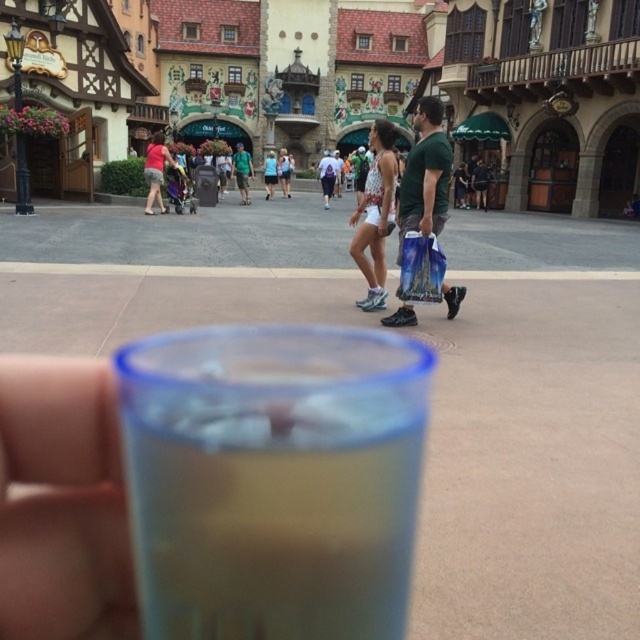
Question: Which of these objects is positioned closest to the matte red shirt at center?

Choices:
 (A) translucent plastic cup at center
 (B) green cotton t-shirt at center

Answer: (B)

Question: Is translucent plastic cup at center wider than green cotton t-shirt at center?

Choices:
 (A) no
 (B) yes

Answer: (A)

Question: Does translucent plastic cup at center appear under green cotton t-shirt at center?

Choices:
 (A) yes
 (B) no

Answer: (A)

Question: Which object is positioned farthest from the green cotton t-shirt at center?

Choices:
 (A) matte red shirt at center
 (B) translucent plastic cup at center

Answer: (A)

Question: Does translucent plastic cup at center have a greater width compared to green cotton t-shirt at center?

Choices:
 (A) no
 (B) yes

Answer: (A)

Question: Which object is farther from the camera taking this photo?

Choices:
 (A) green cotton t-shirt at center
 (B) translucent plastic cup at center

Answer: (A)